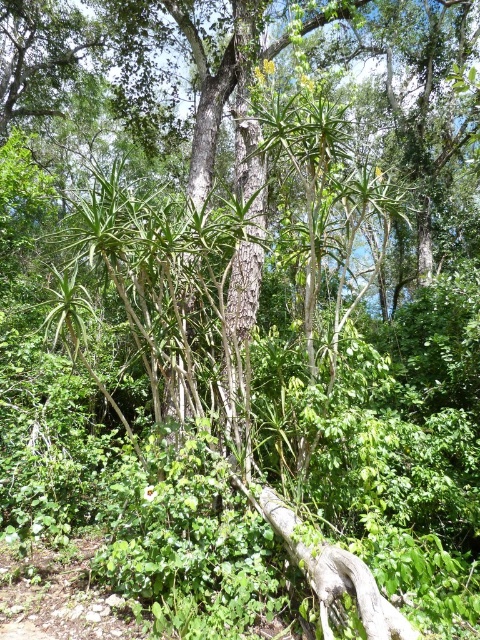
Question: Does smooth bark tree trunk at center have a lesser width compared to gray rough log at center?

Choices:
 (A) yes
 (B) no

Answer: (A)

Question: Can you confirm if smooth bark tree trunk at center is positioned below gray rough log at center?

Choices:
 (A) no
 (B) yes

Answer: (A)

Question: Among these points, which one is farthest from the camera?

Choices:
 (A) (229, 316)
 (B) (303, 557)

Answer: (A)

Question: Is smooth bark tree trunk at center positioned behind gray rough log at center?

Choices:
 (A) no
 (B) yes

Answer: (B)

Question: Which of the following is the closest to the observer?

Choices:
 (A) smooth bark tree trunk at center
 (B) gray rough log at center

Answer: (B)